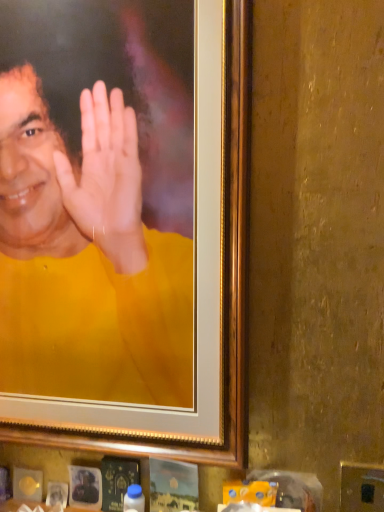
At what (x,y) coordinates should I click in order to perform the action: click on matte gold portrait at upper left. Please return your answer as a coordinate pair (x, y). Image resolution: width=384 pixels, height=512 pixels. Looking at the image, I should click on (86, 260).

This screenshot has height=512, width=384. Describe the element at coordinates (86, 260) in the screenshot. I see `matte gold portrait at upper left` at that location.

In order to face matte gold portrait at upper left, should I rotate leftwards or rightwards?

Rotate left and turn 10.705 degrees.

You are a GUI agent. You are given a task and a screenshot of the screen. Output one action in this format:
    pyautogui.click(x=<x>, y=<y>)
    Task: Click on the matte gold portrait at upper left
    Image resolution: width=384 pixels, height=512 pixels.
    Given the screenshot: What is the action you would take?
    86,260